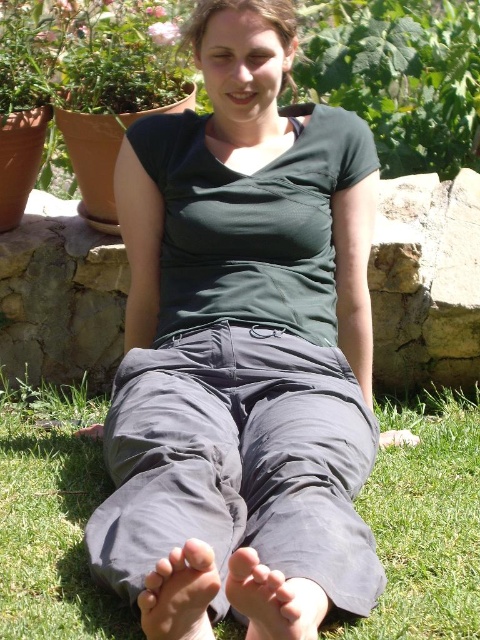
Question: Which is nearer to the dark gray cotton pants at center?

Choices:
 (A) green grass at lower center
 (B) green leafy plant at upper center
 (C) gray fabric foot at lower center
 (D) smooth gray foot at lower center

Answer: (C)

Question: From the image, what is the correct spatial relationship of dark gray cotton pants at center in relation to smooth gray foot at lower center?

Choices:
 (A) below
 (B) above

Answer: (B)

Question: Which object appears closest to the camera in this image?

Choices:
 (A) gray fabric foot at lower center
 (B) green grass at lower center
 (C) dark gray cotton pants at center

Answer: (A)

Question: Which point is farther to the camera?

Choices:
 (A) green grass at lower center
 (B) smooth gray foot at lower center

Answer: (A)

Question: Does dark gray cotton pants at center appear over green leafy plant at upper center?

Choices:
 (A) no
 (B) yes

Answer: (A)

Question: Can you confirm if dark gray cotton pants at center is positioned to the left of green grass at lower center?

Choices:
 (A) no
 (B) yes

Answer: (B)